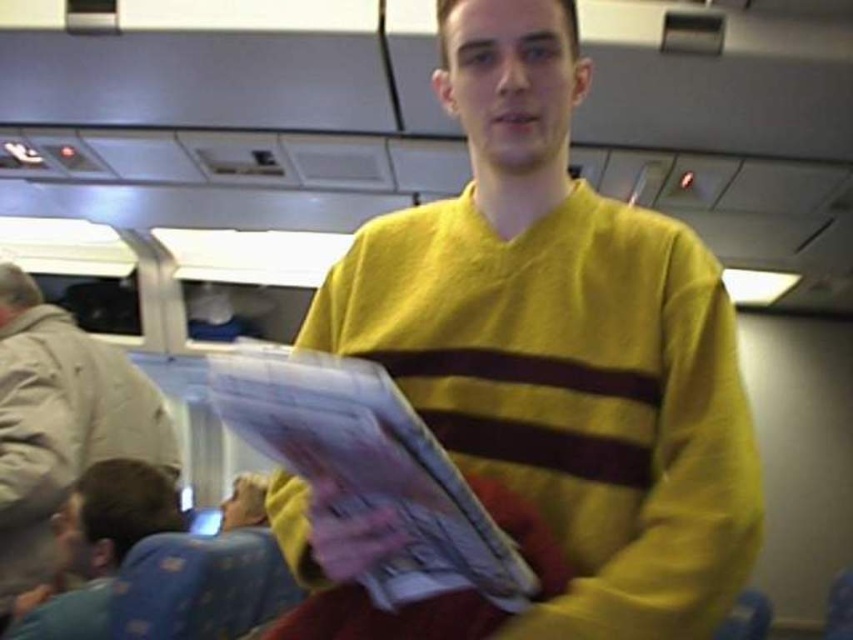
Question: Which of the following is the farthest from the observer?

Choices:
 (A) (74, 401)
 (B) (483, 216)
 (C) (170, 484)

Answer: (C)

Question: Can you confirm if yellow cotton sweater at center is smaller than light brown leather jacket at left?

Choices:
 (A) yes
 (B) no

Answer: (A)

Question: Estimate the real-world distances between objects in this image. Which object is closer to the yellow cotton sweater at center?

Choices:
 (A) light brown leather jacket at left
 (B) blue dotted pajama pants at lower left

Answer: (B)

Question: Among these objects, which one is farthest from the camera?

Choices:
 (A) light brown leather jacket at left
 (B) yellow cotton sweater at center

Answer: (A)

Question: Observing the image, what is the correct spatial positioning of yellow cotton sweater at center in reference to blue dotted pajama pants at lower left?

Choices:
 (A) above
 (B) below

Answer: (A)

Question: Is light brown leather jacket at left to the left of blue dotted pajama pants at lower left from the viewer's perspective?

Choices:
 (A) yes
 (B) no

Answer: (A)